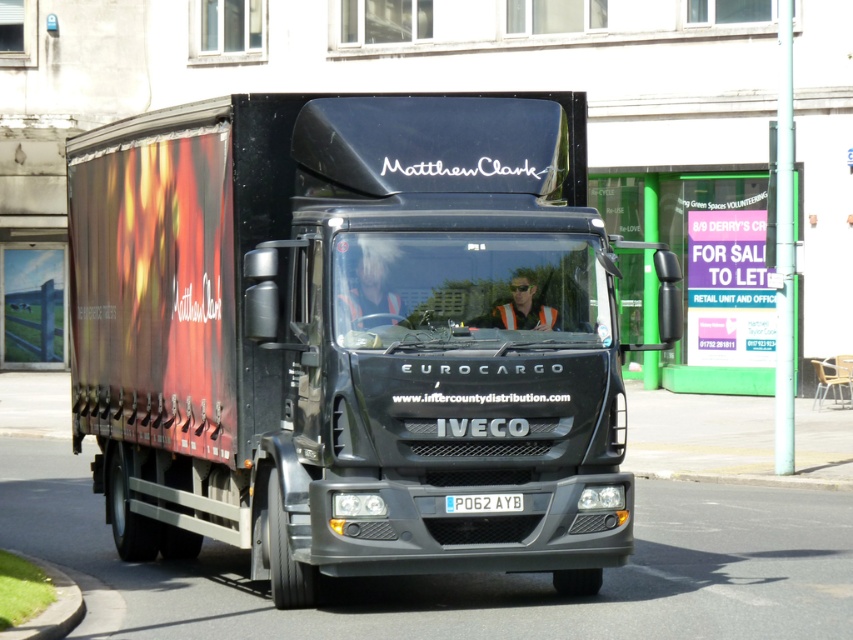
Question: Can you confirm if matte black truck at center is thinner than blue metallic license plate at center?

Choices:
 (A) no
 (B) yes

Answer: (A)

Question: Is matte black truck at center smaller than blue metallic license plate at center?

Choices:
 (A) no
 (B) yes

Answer: (A)

Question: Which point appears closest to the camera in this image?

Choices:
 (A) (407, 304)
 (B) (474, 502)

Answer: (B)

Question: Does matte black truck at center lie in front of blue metallic license plate at center?

Choices:
 (A) yes
 (B) no

Answer: (A)